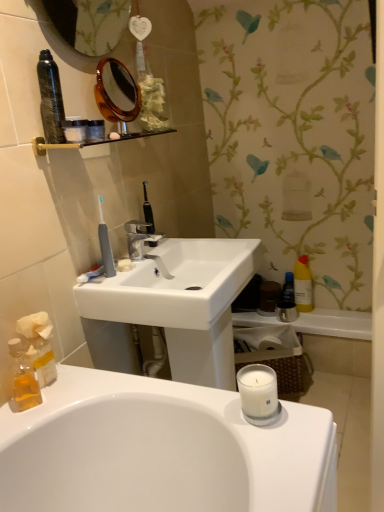
Question: From a real-world perspective, is white paper tissue at lower left located beneath metallic silver bath at lower right?

Choices:
 (A) yes
 (B) no

Answer: (B)

Question: Is white paper tissue at lower left to the left of metallic silver bath at lower right from the viewer's perspective?

Choices:
 (A) yes
 (B) no

Answer: (A)

Question: From the image's perspective, is white paper tissue at lower left located above metallic silver bath at lower right?

Choices:
 (A) yes
 (B) no

Answer: (A)

Question: Can you confirm if white paper tissue at lower left is positioned to the right of metallic silver bath at lower right?

Choices:
 (A) yes
 (B) no

Answer: (B)

Question: Could you tell me if white paper tissue at lower left is facing metallic silver bath at lower right?

Choices:
 (A) no
 (B) yes

Answer: (A)

Question: Is point (122, 259) closer or farther from the camera than point (127, 223)?

Choices:
 (A) closer
 (B) farther

Answer: (A)

Question: From a real-world perspective, is white matte soap at center physically located above or below matte silver faucet at center?

Choices:
 (A) above
 (B) below

Answer: (B)

Question: From their relative heights in the image, would you say white matte soap at center is taller or shorter than matte silver faucet at center?

Choices:
 (A) tall
 (B) short

Answer: (B)

Question: Is white matte soap at center to the left or to the right of matte silver faucet at center in the image?

Choices:
 (A) left
 (B) right

Answer: (A)

Question: Looking at their shapes, would you say yellow matte bottle at right is wider or thinner than matte silver faucet at center?

Choices:
 (A) thin
 (B) wide

Answer: (A)

Question: Is yellow matte bottle at right bigger or smaller than matte silver faucet at center?

Choices:
 (A) small
 (B) big

Answer: (B)

Question: Considering the positions of point (302, 287) and point (145, 234), is point (302, 287) closer or farther from the camera than point (145, 234)?

Choices:
 (A) farther
 (B) closer

Answer: (A)

Question: From a real-world perspective, is yellow matte bottle at right positioned above or below matte silver faucet at center?

Choices:
 (A) below
 (B) above

Answer: (A)

Question: Is blue glossy mouthwash at right, which is the 1th mouthwash in back-to-front order, wider or thinner than matte silver faucet at center?

Choices:
 (A) wide
 (B) thin

Answer: (B)

Question: From the image's perspective, is blue glossy mouthwash at right, which ranks as the 2th mouthwash in left-to-right order, located above or below matte silver faucet at center?

Choices:
 (A) above
 (B) below

Answer: (B)